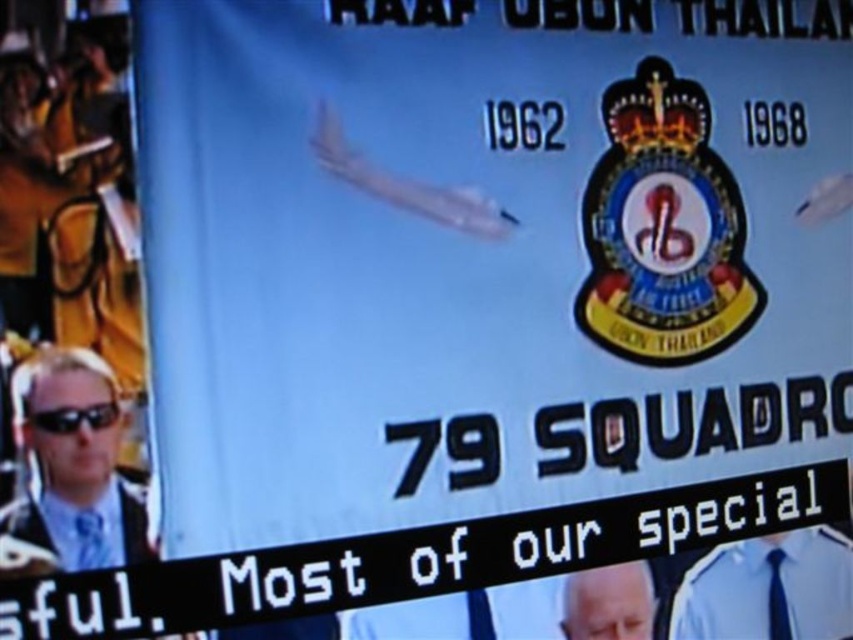
Question: Among these objects, which one is nearest to the camera?

Choices:
 (A) dark blue silk tie at center
 (B) blue fabric tie at lower left
 (C) blue fabric tie at lower center
 (D) matte black sunglasses at left

Answer: (D)

Question: In this image, where is matte black sunglasses at left located relative to gray hair at center?

Choices:
 (A) below
 (B) above

Answer: (B)

Question: Estimate the real-world distances between objects in this image. Which object is farther from the gray hair at center?

Choices:
 (A) blue fabric tie at lower center
 (B) blue shirt at center
 (C) matte black sunglasses at left

Answer: (C)

Question: Is gray hair at center above blue fabric tie at lower left?

Choices:
 (A) yes
 (B) no

Answer: (B)

Question: Which point appears farthest from the camera in this image?

Choices:
 (A) (119, 529)
 (B) (494, 634)
 (C) (90, 410)
 (D) (102, 554)

Answer: (B)

Question: Can you confirm if black plastic goggles at lower left is wider than blue fabric tie at lower center?

Choices:
 (A) yes
 (B) no

Answer: (A)